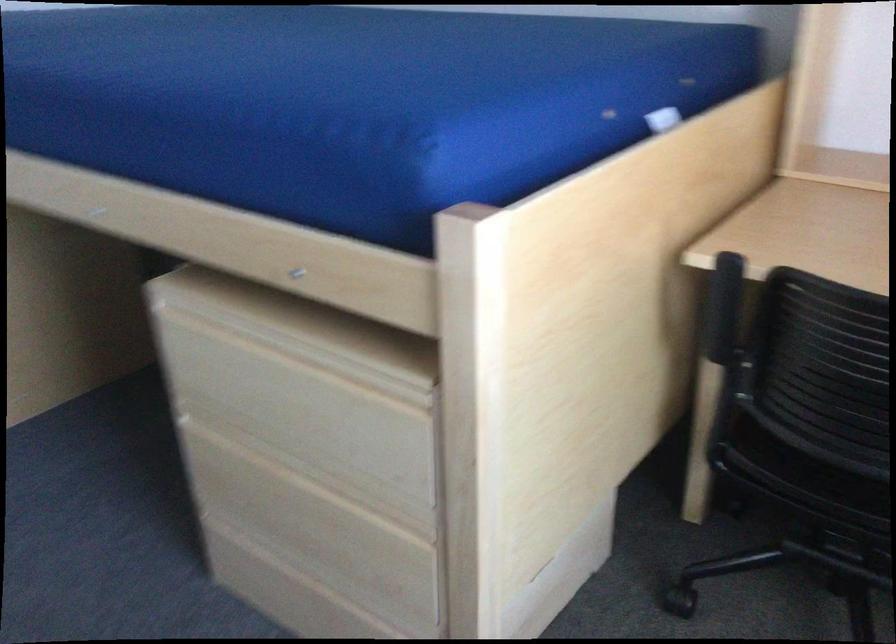
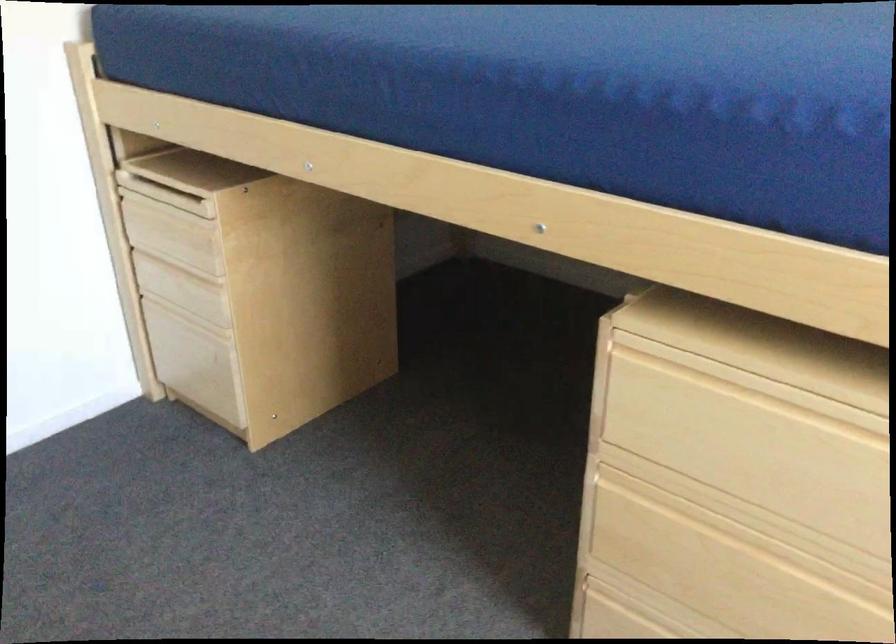
Find the pixel in the second image that matches [238,348] in the first image.

(743, 406)